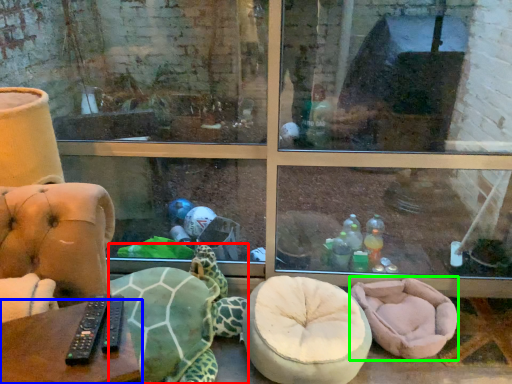
Question: Which object is positioned closest to tortoise (highlighted by a red box)? Select from table (highlighted by a blue box) and bean bag chair (highlighted by a green box).

Choices:
 (A) table
 (B) bean bag chair

Answer: (B)